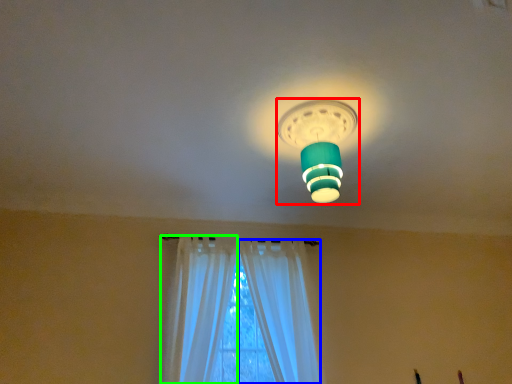
Question: Which object is the farthest from lamp (highlighted by a red box)? Choose among these: curtain (highlighted by a blue box) or curtain (highlighted by a green box).

Choices:
 (A) curtain
 (B) curtain

Answer: (B)